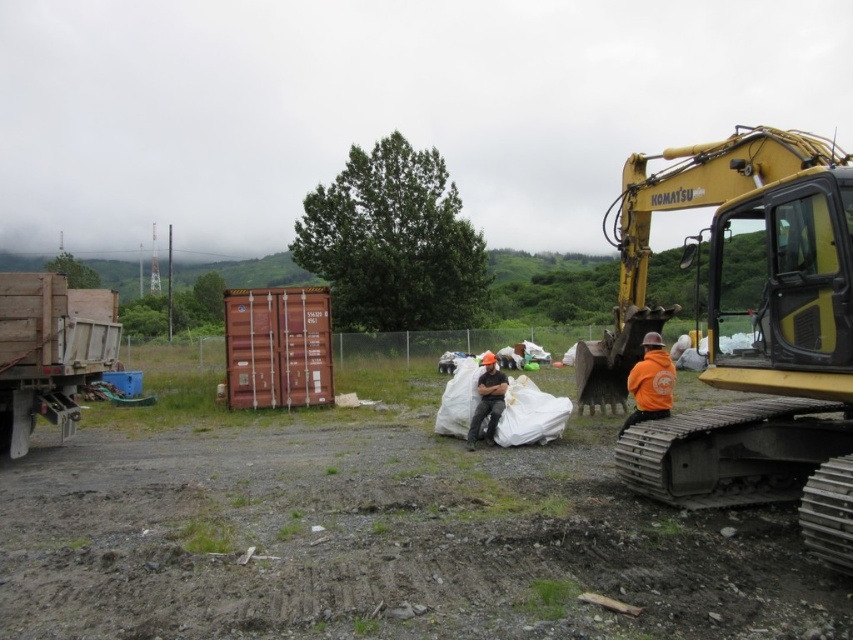
You are a safety inspector at the construction site. You need to ensure that the yellow metallic excavator at right and wooden truck at left are not blocking the emergency exit located at the center. Based on their sizes, which one is more likely to block the exit if positioned near it?

The yellow metallic excavator at right is larger in size than the wooden truck at left, so it is more likely to block the emergency exit if positioned near it.

You are a worker on the construction site. You need to move a heavy tool from the wooden truck at left to the orange hard hat at center. Which direction should you move the tool to reach the hard hat?

The wooden truck at left is above the orange hard hat at center, so you should move the tool downward to reach the orange hard hat at center.

You are a safety inspector at the construction site. You need to check the orange hard hat at center and the wooden truck at left. Which object is closer to the Komatsu excavator on the right?

The wooden truck at left is to the left of orange hard hat at center, so the orange hard hat at center is closer to the Komatsu excavator on the right.